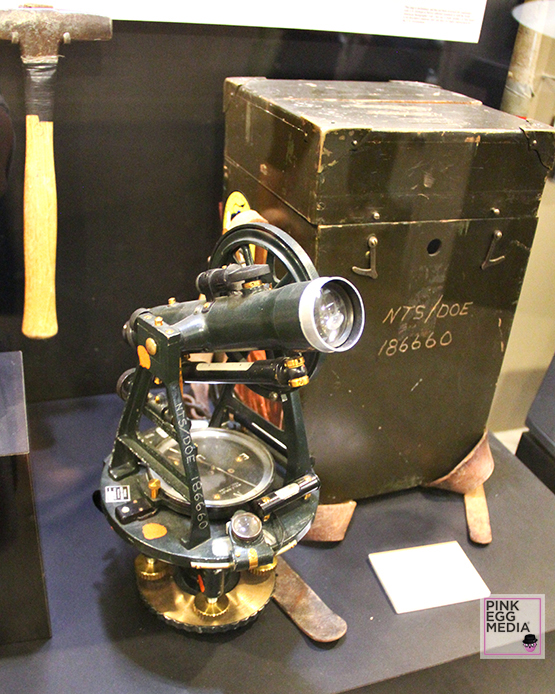
The width and height of the screenshot is (555, 694). Find the location of `shelf`. shelf is located at coordinates (11, 393).